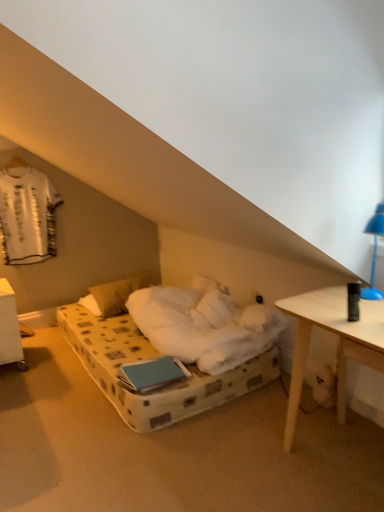
This screenshot has height=512, width=384. What do you see at coordinates (374, 251) in the screenshot? I see `blue plastic lamp at upper right` at bounding box center [374, 251].

Consider the image. Measure the distance between point (x=104, y=317) and camera.

Point (x=104, y=317) is 11.14 feet from camera.

The image size is (384, 512). I want to click on white soft pillow at center, so click(117, 294).

The width and height of the screenshot is (384, 512). I want to click on white fabric shirt at upper left, so click(27, 215).

Where is `blue plastic lamp at upper right`? blue plastic lamp at upper right is located at coordinates (374, 251).

Looking at their sizes, would you say white fabric shirt at upper left is wider or thinner than blue plastic lamp at upper right?

Clearly, white fabric shirt at upper left has less width compared to blue plastic lamp at upper right.

Is white fabric shirt at upper left positioned behind blue plastic lamp at upper right?

Yes, white fabric shirt at upper left is further from the viewer.

Locate an element on the screen. bedside lamp below the white fabric shirt at upper left (from the image's perspective) is located at coordinates 374,251.

From a real-world perspective, who is located lower, white fabric shirt at upper left or white plastic nightstand at lower left?

white plastic nightstand at lower left is physically lower.

Considering the positions of objects white fabric shirt at upper left and white plastic nightstand at lower left in the image provided, who is more to the right, white fabric shirt at upper left or white plastic nightstand at lower left?

Positioned to the right is white fabric shirt at upper left.

Which is correct: white fabric shirt at upper left is inside white plastic nightstand at lower left, or outside of it?

white fabric shirt at upper left is not inside white plastic nightstand at lower left, it's outside.

Does white plastic nightstand at lower left have a greater width compared to white soft pillow at center?

Yes, white plastic nightstand at lower left is wider than white soft pillow at center.

Considering the relative sizes of white plastic nightstand at lower left and white soft pillow at center in the image provided, is white plastic nightstand at lower left shorter than white soft pillow at center?

In fact, white plastic nightstand at lower left may be taller than white soft pillow at center.

Is white plastic nightstand at lower left oriented away from white soft pillow at center?

white plastic nightstand at lower left does not have its back to white soft pillow at center.

Which is more to the left, white plastic nightstand at lower left or white soft pillow at center?

white plastic nightstand at lower left.

Consider the image. Is white plastic nightstand at lower left inside white soft pillow at center?

Definitely not — white plastic nightstand at lower left is not inside white soft pillow at center.

Is white soft pillow at center taller or shorter than white plastic nightstand at lower left?

In the image, white soft pillow at center appears to be shorter than white plastic nightstand at lower left.

Which is in front, white soft pillow at center or white plastic nightstand at lower left?

white plastic nightstand at lower left is more forward.

Is white fabric shirt at upper left not within white soft pillow at center?

Yes, white fabric shirt at upper left is not within white soft pillow at center.

Between white fabric shirt at upper left and white soft pillow at center, which one has smaller size?

With smaller size is white fabric shirt at upper left.

Based on the photo, which object is wider, white fabric shirt at upper left or white soft pillow at center?

With larger width is white soft pillow at center.

From the image's perspective, is white soft pillow at center beneath white fabric shirt at upper left?

Correct, white soft pillow at center appears lower than white fabric shirt at upper left in the image.

Measure the distance between white soft pillow at center and white fabric shirt at upper left.

white soft pillow at center is 32.05 inches from white fabric shirt at upper left.

Can you see white soft pillow at center touching white fabric shirt at upper left?

white soft pillow at center is not next to white fabric shirt at upper left, and they're not touching.

From the picture: How different are the orientations of white soft pillow at center and white fabric shirt at upper left in degrees?

The angle between the facing direction of white soft pillow at center and the facing direction of white fabric shirt at upper left is 1.2 degrees.

Would you say blue plastic lamp at upper right is to the left or to the right of white plastic nightstand at lower left in the picture?

From the image, it's evident that blue plastic lamp at upper right is to the right of white plastic nightstand at lower left.

Does blue plastic lamp at upper right have a lesser width compared to white plastic nightstand at lower left?

Correct, the width of blue plastic lamp at upper right is less than that of white plastic nightstand at lower left.

Considering the sizes of objects blue plastic lamp at upper right and white plastic nightstand at lower left in the image provided, who is taller, blue plastic lamp at upper right or white plastic nightstand at lower left?

Standing taller between the two is white plastic nightstand at lower left.

Is blue plastic lamp at upper right aimed at white plastic nightstand at lower left?

No, blue plastic lamp at upper right is not aimed at white plastic nightstand at lower left.

Where is `bedside lamp lying in front of the white fabric shirt at upper left`? The height and width of the screenshot is (512, 384). bedside lamp lying in front of the white fabric shirt at upper left is located at coordinates (374, 251).

Where is `laundry that appears on the right of white plastic nightstand at lower left`? This screenshot has width=384, height=512. laundry that appears on the right of white plastic nightstand at lower left is located at coordinates (27, 215).

Considering their positions, is white plastic nightstand at lower left positioned further to white fabric shirt at upper left than blue plastic lamp at upper right?

blue plastic lamp at upper right is positioned further to the anchor white fabric shirt at upper left.

When comparing their distances from white fabric shirt at upper left, does white plastic nightstand at lower left or white soft pillow at center seem closer?

white plastic nightstand at lower left lies closer to white fabric shirt at upper left than the other object.

Based on their spatial positions, is white soft pillow at center or white fabric shirt at upper left further from white plastic nightstand at lower left?

Based on the image, white fabric shirt at upper left appears to be further to white plastic nightstand at lower left.

Considering their positions, is white soft pillow at center positioned closer to white fabric shirt at upper left than blue plastic lamp at upper right?

white soft pillow at center.

When comparing their distances from white fabric shirt at upper left, does blue plastic lamp at upper right or white plastic nightstand at lower left seem closer?

white plastic nightstand at lower left is closer to white fabric shirt at upper left.

When comparing their distances from blue plastic lamp at upper right, does white fabric shirt at upper left or white soft pillow at center seem closer?

white soft pillow at center.

Considering their positions, is white plastic nightstand at lower left positioned further to blue plastic lamp at upper right than white soft pillow at center?

Among the two, white plastic nightstand at lower left is located further to blue plastic lamp at upper right.

Based on their spatial positions, is white plastic nightstand at lower left or blue plastic lamp at upper right further from white soft pillow at center?

Among the two, blue plastic lamp at upper right is located further to white soft pillow at center.

The image size is (384, 512). I want to click on pillow between white fabric shirt at upper left and white plastic nightstand at lower left in the vertical direction, so click(117, 294).

Locate an element on the screen. This screenshot has width=384, height=512. pillow between white fabric shirt at upper left and blue plastic lamp at upper right is located at coordinates (117, 294).

In order to click on pillow between white plastic nightstand at lower left and blue plastic lamp at upper right in this screenshot , I will do `click(117, 294)`.

Find the location of a particular element. laundry located between white plastic nightstand at lower left and blue plastic lamp at upper right in the left-right direction is located at coordinates (27, 215).